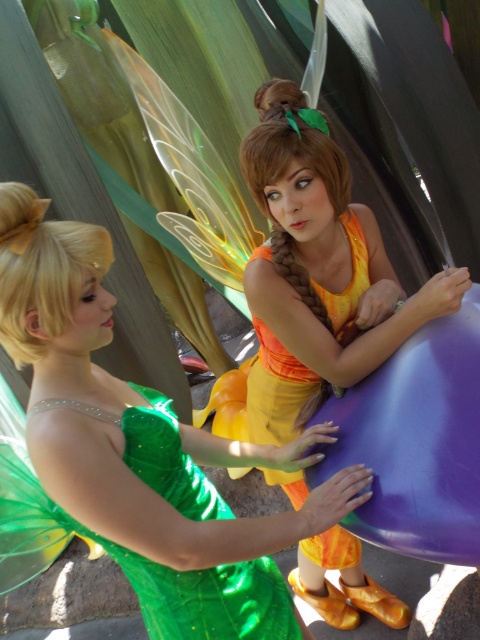
You are an artist trying to sketch the scene. To ensure accuracy, you need to know the exact position of the matte orange dress at center. What are its coordinates?

The coordinates of the matte orange dress at center are at point (x=313, y=276).

You are a photographer setting up for a fairy costume photoshoot. You have two models wearing the green satin dress at center and the green shiny dress at center. The minimum distance required for your camera lens to focus clearly is 8 centimeters. Can both dresses be in focus if they are currently positioned 7.80 centimeters apart?

The green satin dress at center is only 7.80 centimeters from the green shiny dress at center, which is less than the 8 centimeter minimum distance required for the camera lens to focus clearly. Therefore, both dresses cannot be in focus at the same time.

You are a photographer positioned in front of the two fairies. You need to capture a clear closeup of the matte orange dress at center without the green shiny dress at center blocking the view. Is this possible given their positions?

The matte orange dress at center is further to the viewer than the green shiny dress at center, so taking a closeup of the matte orange dress at center would naturally block the view of the green shiny dress at center. Therefore, it is possible to capture the matte orange dress at center without obstruction.